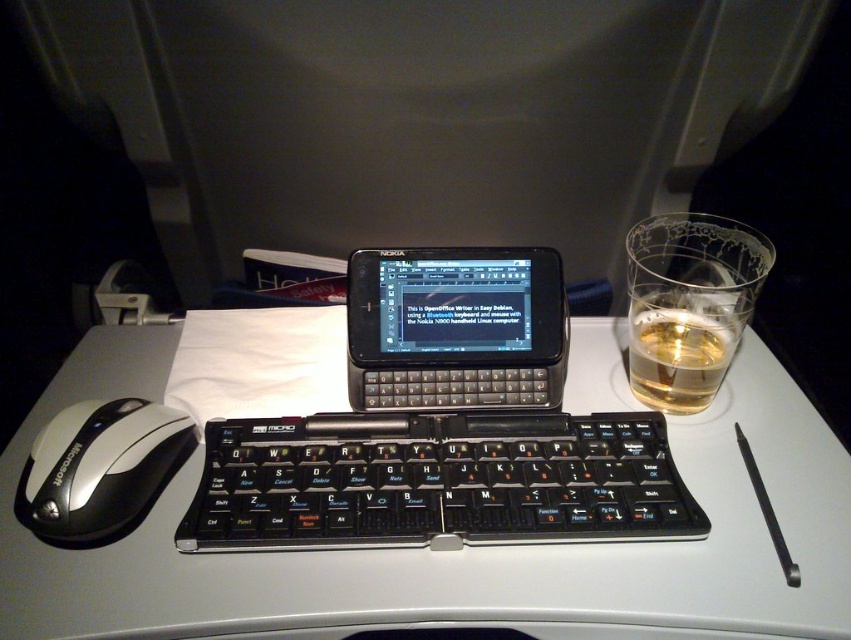
You are a passenger on an airplane and want to place your phone on the table. Based on the scene, can you tell if the black plastic nokia phone at center will fit on the white plastic table at center?

The white plastic table at center is below the black plastic nokia phone at center, so the phone is already placed on the table and fits.

You are trying to place a small sticker on the tray table between the black plastic nokia phone at center and the translucent glass at right. Which object should you place the sticker closer to if you want it to be closer to the taller object?

The translucent glass at right is taller than the black plastic nokia phone at center, so you should place the sticker closer to the translucent glass at right.